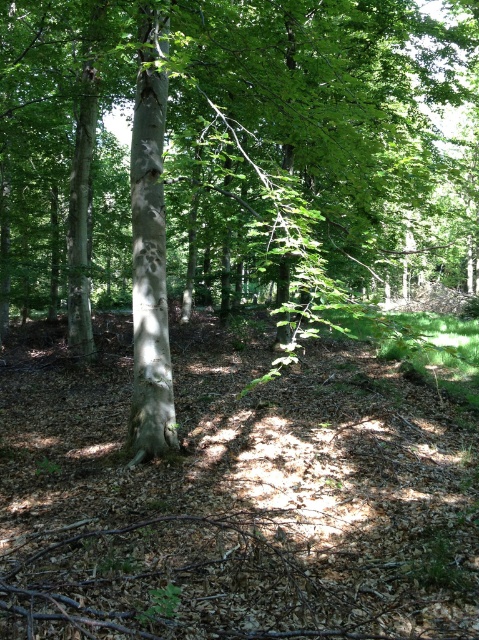
You are standing in the forest and want to take a photo of the green smooth tree trunk at center. To ensure it is centered in your viewfinder, where should you aim your camera? Specify the coordinates as a point in the format like 0.236, 0.482.

The green smooth tree trunk at center is located at coordinates (230, 150), so aim your camera at that point to center it in the viewfinder.

You are a hiker trying to identify two trees in the forest. You notice a green smooth tree trunk at center and a smooth white bark at center. Which one is wider?

The green smooth tree trunk at center is wider than the smooth white bark at center.

You are a hiker trying to navigate through the forest. You see a green smooth tree trunk at center and a smooth white bark at center. How far apart are these two landmarks?

The green smooth tree trunk at center and the smooth white bark at center are 13.24 meters apart.